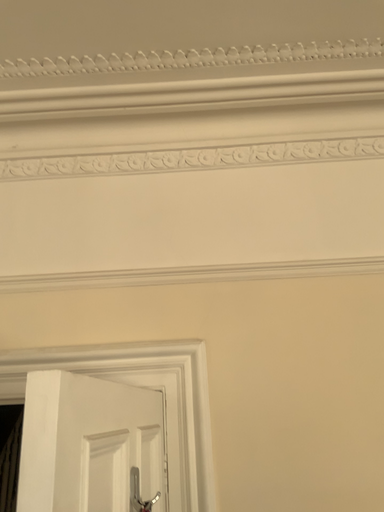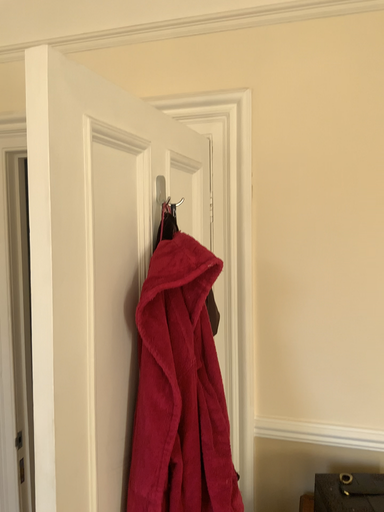
Question: How did the camera likely rotate when shooting the video?

Choices:
 (A) rotated left
 (B) rotated right

Answer: (A)